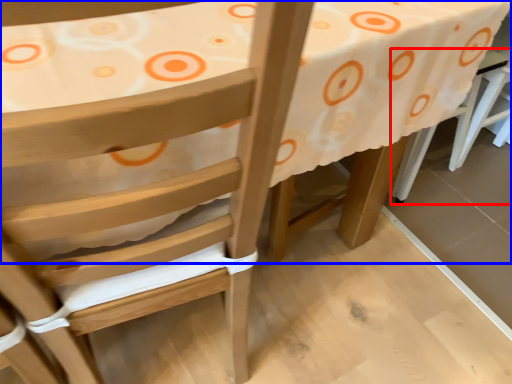
Question: Which of the following is the farthest to the observer, chair (highlighted by a red box) or table (highlighted by a blue box)?

Choices:
 (A) chair
 (B) table

Answer: (A)